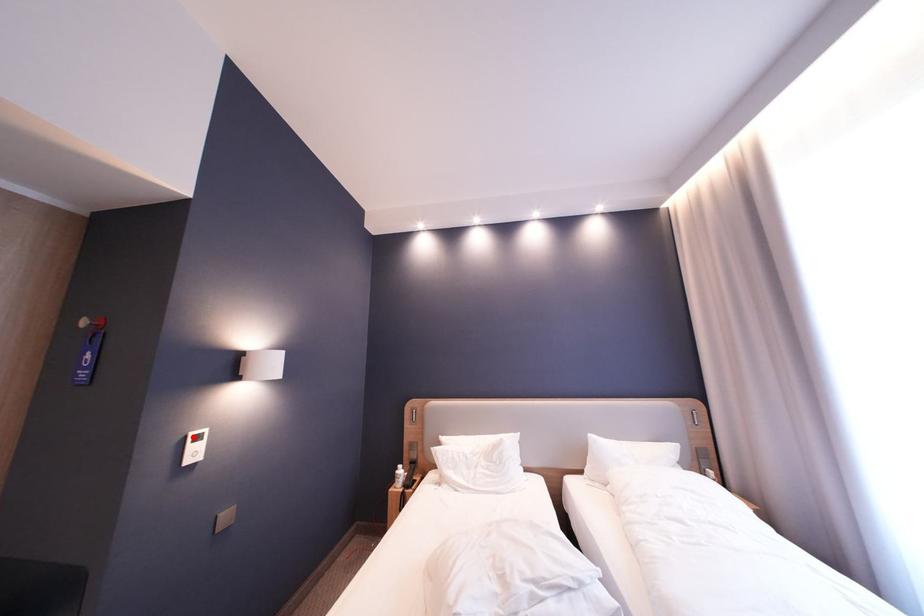
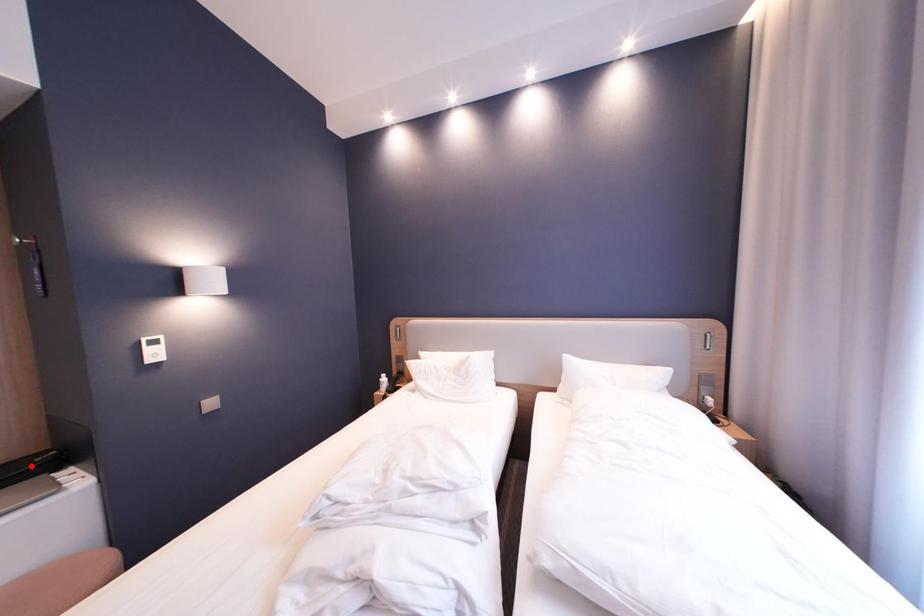
I am providing you with two images of the same scene from different viewpoints. A red point is marked on the first image and another point is marked on the second image. Is the marked point in image1 the same physical position as the marked point in image2?

No